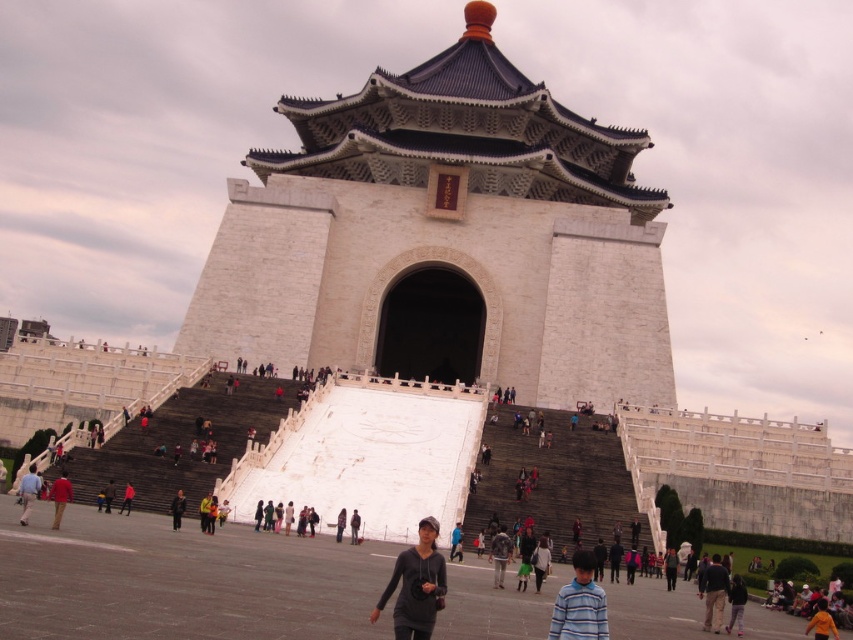
You are standing at the base of the grand pavilion and notice a person wearing a dark gray sweater at lower left. If you want to approach them, which direction should you walk relative to the pavilion?

To approach the dark gray sweater at lower left, you should walk towards the lower left direction relative to the pavilion since their position is at point [28,492].

You are a photographer planning to capture a group photo of the dark gray sweater at center and the red fabric jacket at lower left. Which of the two clothing items appears narrower in the image?

The dark gray sweater at center has a lesser width compared to the red fabric jacket at lower left, so it appears narrower in the image.

You are standing at the base of the grand pavilion and notice two people in the foreground. One is wearing dark blue jeans at center and the other is wearing a light brown leather jacket at center. Which person is standing higher up the stairs?

The dark blue jeans at center is positioned over light brown leather jacket at center, so the person wearing dark blue jeans at center is standing higher up the stairs.